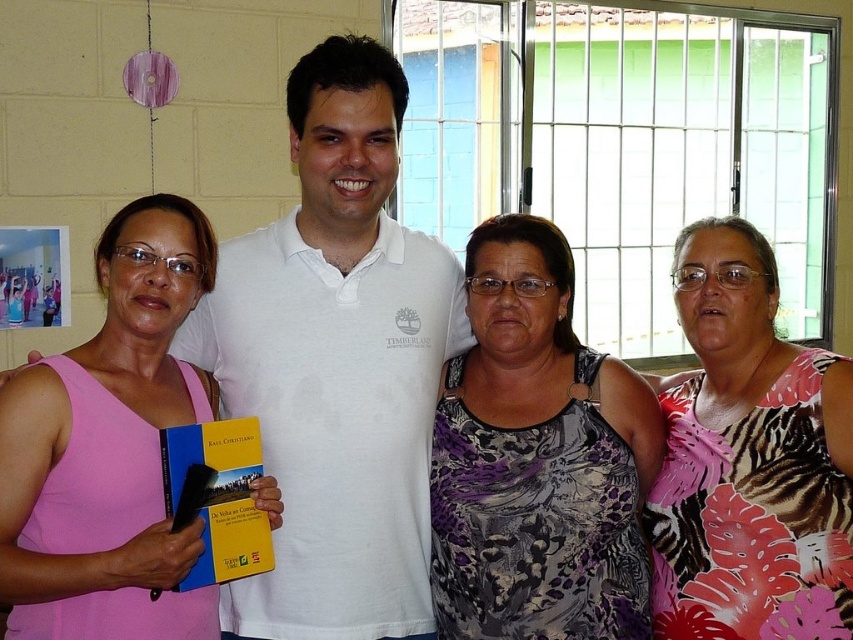
Question: Is the position of pink fabric tank top at left less distant than that of pink floral dress at center?

Choices:
 (A) yes
 (B) no

Answer: (A)

Question: Which point is farther to the camera?

Choices:
 (A) purple printed tank top at center
 (B) white cotton shirt at center
 (C) pink fabric tank top at left

Answer: (A)

Question: Which object is the closest to the white cotton shirt at center?

Choices:
 (A) pink floral dress at center
 (B) purple printed tank top at center

Answer: (B)

Question: Does purple printed tank top at center lie behind pink floral dress at center?

Choices:
 (A) yes
 (B) no

Answer: (A)

Question: Which object is positioned closest to the white cotton shirt at center?

Choices:
 (A) pink floral dress at center
 (B) pink fabric tank top at left
 (C) purple printed tank top at center

Answer: (C)

Question: Does white cotton shirt at center appear on the right side of pink fabric tank top at left?

Choices:
 (A) no
 (B) yes

Answer: (B)